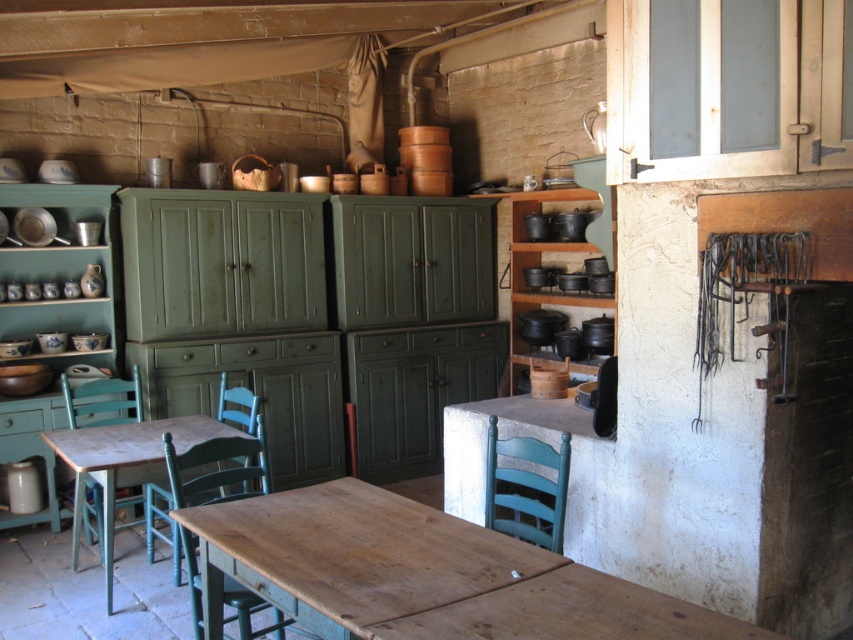
Is wooden chair at center to the right of teal wood chair at lower center from the viewer's perspective?

In fact, wooden chair at center is to the left of teal wood chair at lower center.

Is wooden chair at center positioned before teal wood chair at lower center?

Yes.

At what (x,y) coordinates should I click in order to perform the action: click on wooden chair at center. Please return your answer as a coordinate pair (x, y). The image size is (853, 640). Looking at the image, I should click on (210, 474).

At what (x,y) coordinates should I click in order to perform the action: click on wooden chair at center. Please return your answer as a coordinate pair (x, y). Looking at the image, I should click on (210, 474).

Which of these two, wooden table at lower left or teal painted wood chair at lower left, stands taller?

wooden table at lower left is taller.

Is wooden table at lower left in front of teal painted wood chair at lower left?

Yes, it is in front of teal painted wood chair at lower left.

Find the location of `wooden table at lower left`. wooden table at lower left is located at coordinates (125, 465).

Can you confirm if wooden chair at center is wider than teal painted wood chair at lower left?

Yes.

Is point (264, 605) farther from viewer compared to point (62, 376)?

No, (264, 605) is closer to viewer.

Find the location of a particular element. wooden chair at center is located at coordinates (210, 474).

Where is `wooden chair at center`? This screenshot has height=640, width=853. wooden chair at center is located at coordinates (210, 474).